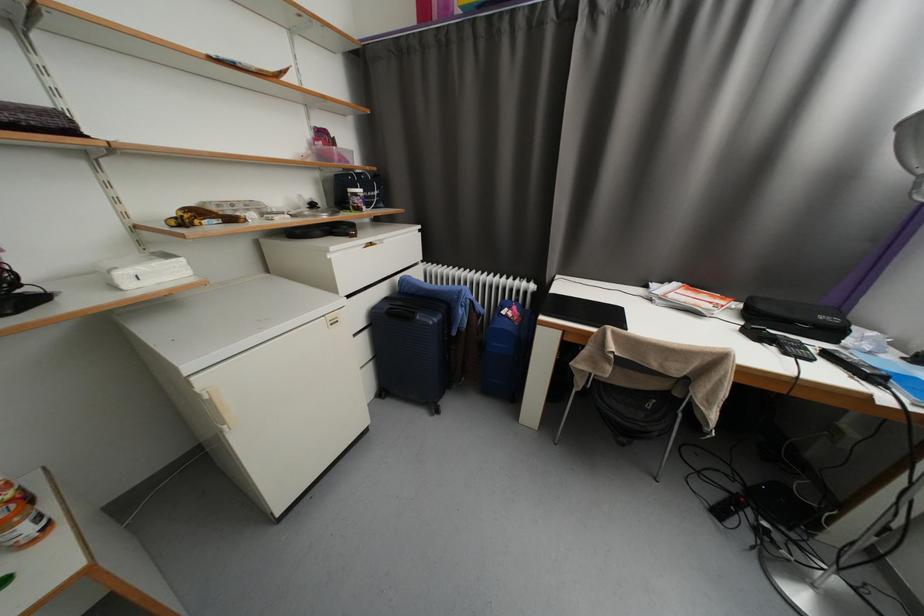
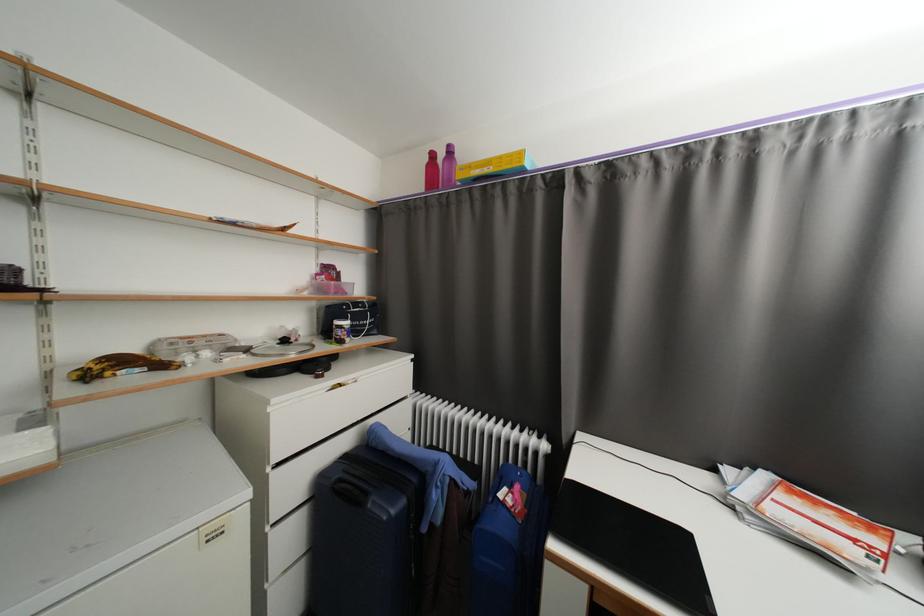
Question: The first image is from the beginning of the video and the second image is from the end. How did the camera likely rotate when shooting the video?

Choices:
 (A) Left
 (B) Right
 (C) Up
 (D) Down

Answer: (C)